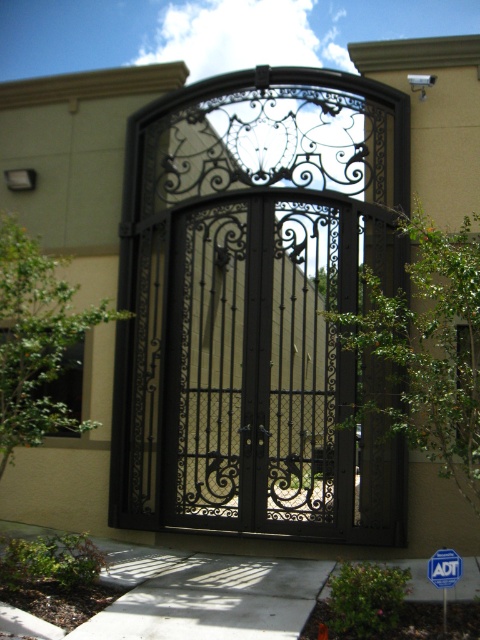
You are standing at the entrance of the beige building and want to walk towards the gate. There are two points marked on the path. Which point should you reach first, point (302, 358) or point (440, 561)?

Point (440, 561) should be reached first because point (302, 358) is behind it.

You are standing at the entrance of the building and want to reach the blue plastic sign at lower right. Which direction should you move relative to the black wrought iron gate at center?

To reach the blue plastic sign at lower right, you should move towards the blue plastic sign at lower right since it is closer to you than the black wrought iron gate at center.

You are standing at the entrance of the building and want to reach the gate. According to the image, where exactly is the black wrought iron gate at center located in relation to your position?

The black wrought iron gate at center is located at point 0.480 on the x axis and 0.535 on the y axis relative to your position.